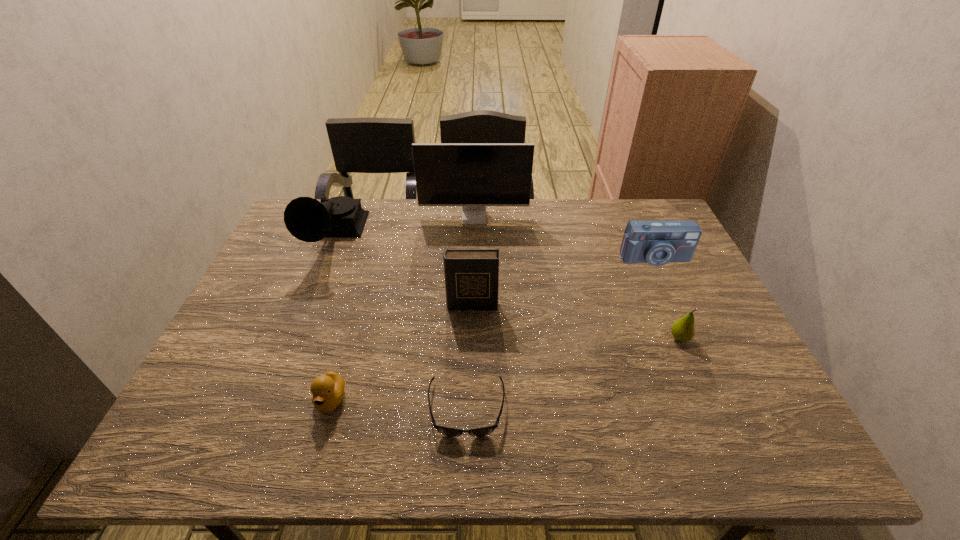
Where is `sunglasses at the near edge`? This screenshot has width=960, height=540. sunglasses at the near edge is located at coordinates (483, 431).

The width and height of the screenshot is (960, 540). I want to click on object situated at the left edge, so click(x=307, y=219).

Locate an element on the screen. camera positioned at the right edge is located at coordinates (657, 243).

Find the location of a particular element. pear situated at the right edge is located at coordinates (682, 330).

The height and width of the screenshot is (540, 960). What are the coordinates of `object present at the far left corner` in the screenshot? It's located at (307, 219).

Locate an element on the screen. The width and height of the screenshot is (960, 540). vacant region at the far edge is located at coordinates (531, 215).

Identify the location of vacant space at the near edge of the desktop. (324, 437).

In the image, there is a desktop. Identify the location of vacant region at the left edge. point(301,243).

I want to click on vacant space at the right edge of the desktop, so click(x=757, y=393).

Where is `vacant space at the near right corner of the desktop`? This screenshot has height=540, width=960. vacant space at the near right corner of the desktop is located at coordinates (766, 441).